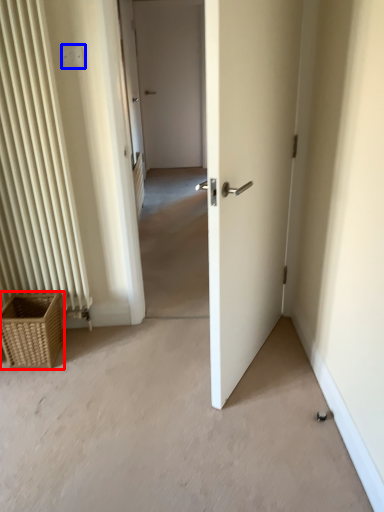
Question: Which object is further to the camera taking this photo, picnic basket (highlighted by a red box) or electric outlet (highlighted by a blue box)?

Choices:
 (A) picnic basket
 (B) electric outlet

Answer: (A)